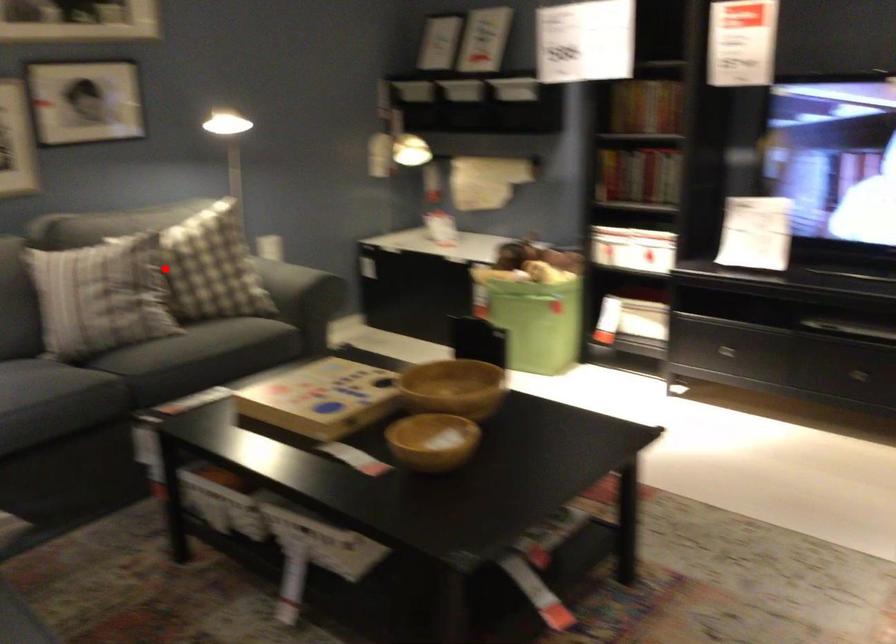
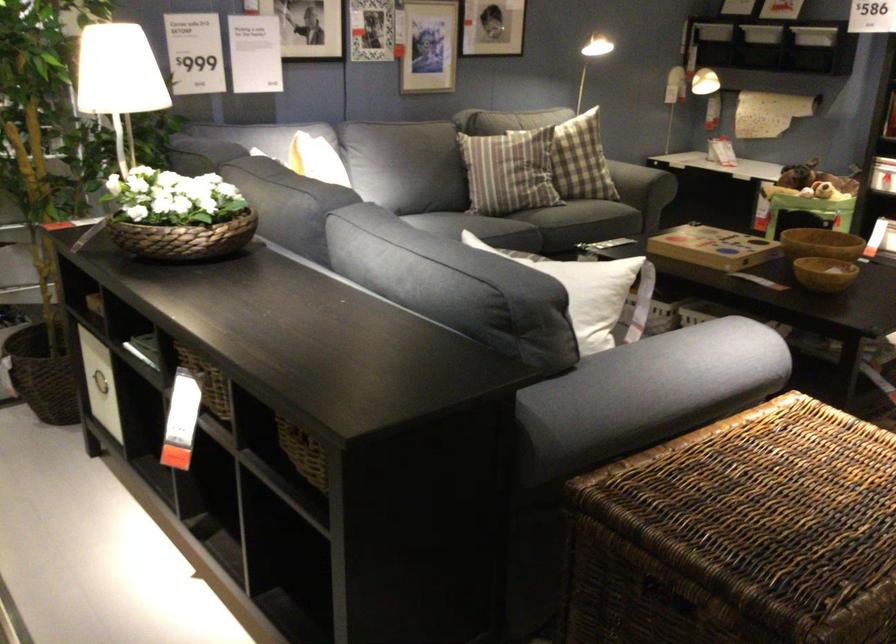
Where in the second image is the point corresponding to the highlighted location from the first image?

(581, 160)